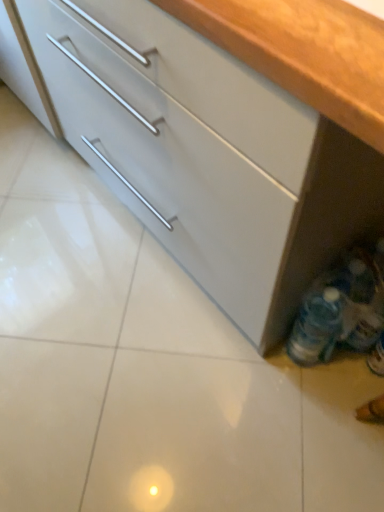
Question: Does matte white cabinet at lower right contain translucent plastic bottles at lower right?

Choices:
 (A) no
 (B) yes

Answer: (B)

Question: Can you confirm if matte white cabinet at lower right is bigger than translucent plastic bottles at lower right?

Choices:
 (A) no
 (B) yes

Answer: (B)

Question: Considering the relative sizes of matte white cabinet at lower right and translucent plastic bottles at lower right in the image provided, is matte white cabinet at lower right thinner than translucent plastic bottles at lower right?

Choices:
 (A) no
 (B) yes

Answer: (A)

Question: Is matte white cabinet at lower right facing away from translucent plastic bottles at lower right?

Choices:
 (A) no
 (B) yes

Answer: (B)

Question: From the image's perspective, is matte white cabinet at lower right over translucent plastic bottles at lower right?

Choices:
 (A) no
 (B) yes

Answer: (B)

Question: Does matte white cabinet at lower right lie behind translucent plastic bottles at lower right?

Choices:
 (A) yes
 (B) no

Answer: (B)

Question: Is the position of translucent plastic bottles at lower right less distant than that of matte white cabinet at lower right?

Choices:
 (A) yes
 (B) no

Answer: (B)

Question: Is translucent plastic bottles at lower right at the left side of matte white cabinet at lower right?

Choices:
 (A) no
 (B) yes

Answer: (A)

Question: Is translucent plastic bottles at lower right to the right of matte white cabinet at lower right from the viewer's perspective?

Choices:
 (A) yes
 (B) no

Answer: (A)

Question: Is translucent plastic bottles at lower right facing towards matte white cabinet at lower right?

Choices:
 (A) no
 (B) yes

Answer: (B)

Question: From a real-world perspective, is translucent plastic bottles at lower right located beneath matte white cabinet at lower right?

Choices:
 (A) yes
 (B) no

Answer: (A)

Question: Is translucent plastic bottles at lower right taller than matte white cabinet at lower right?

Choices:
 (A) yes
 (B) no

Answer: (B)

Question: From a real-world perspective, relative to matte white cabinet at lower right, is translucent plastic bottles at lower right vertically above or below?

Choices:
 (A) below
 (B) above

Answer: (A)